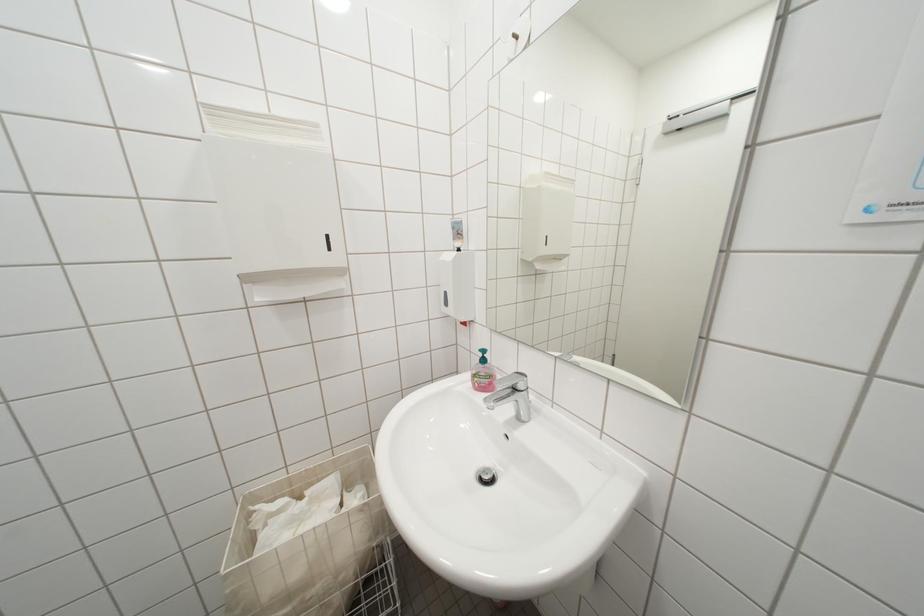
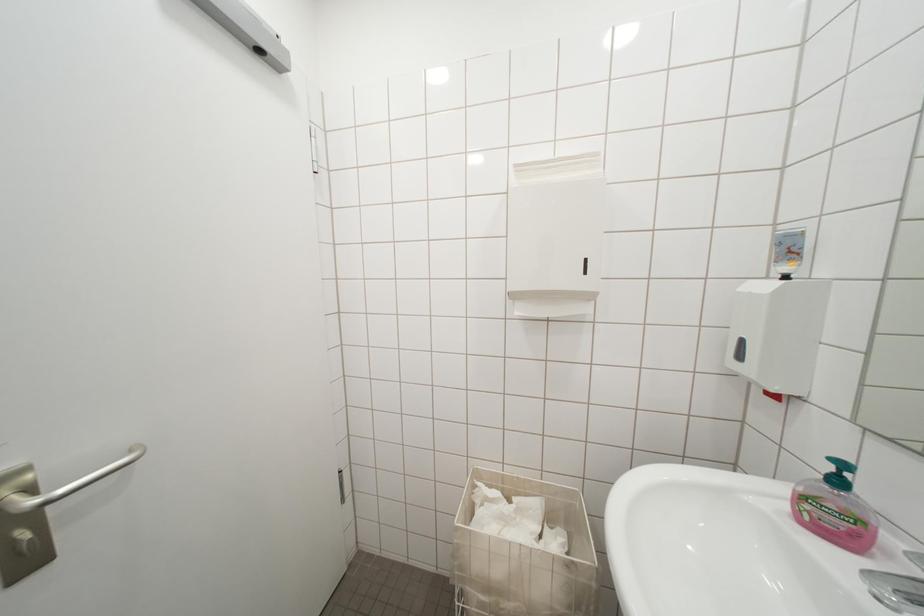
Question: The images are taken continuously from a first-person perspective. In which direction is your viewpoint rotating?

Choices:
 (A) Left
 (B) Right
 (C) Up
 (D) Down

Answer: (A)